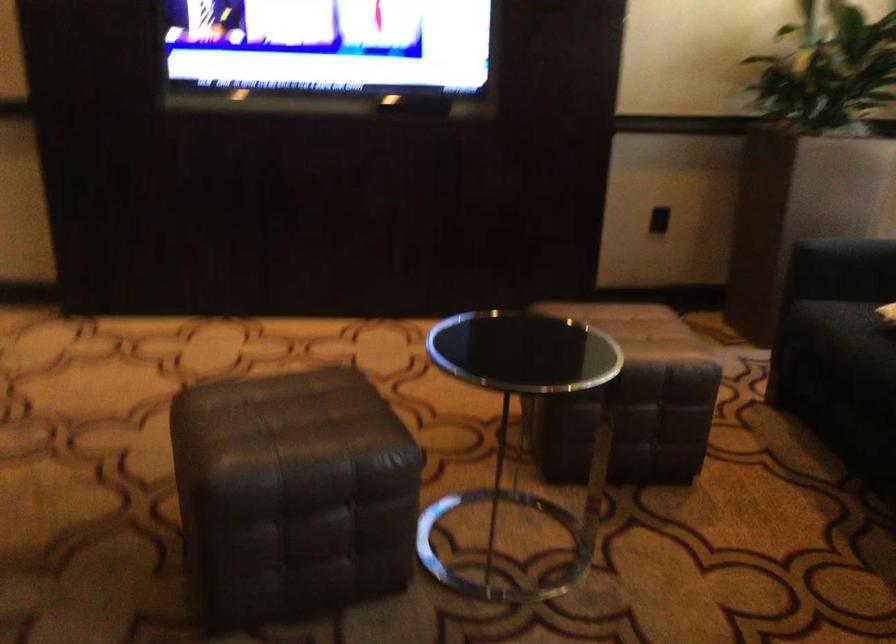
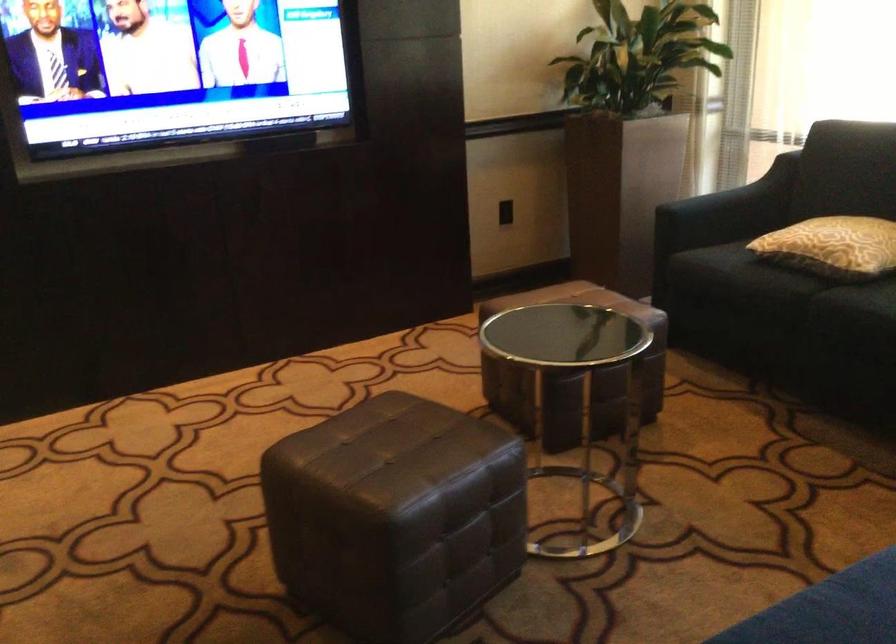
In the second image, find the point that corresponds to point (218, 482) in the first image.

(394, 516)